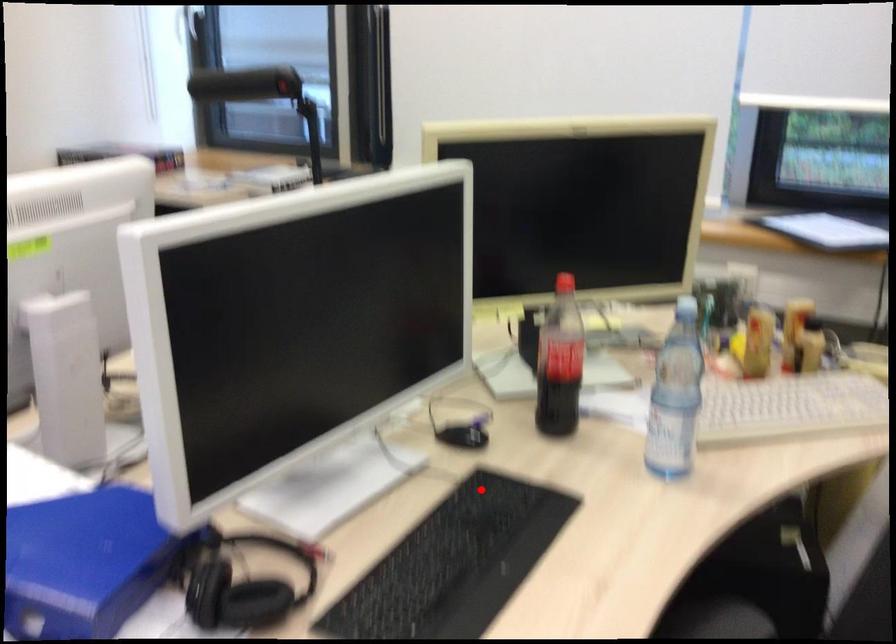
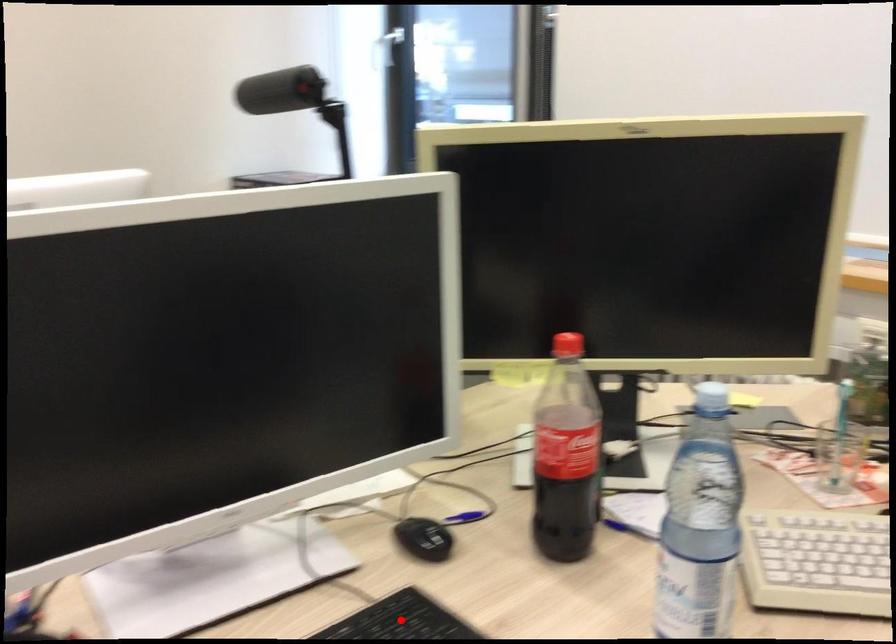
I am providing you with two images of the same scene from different viewpoints. A red point is marked on the first image and another point is marked on the second image. Do the highlighted points in image1 and image2 indicate the same real-world spot?

Yes